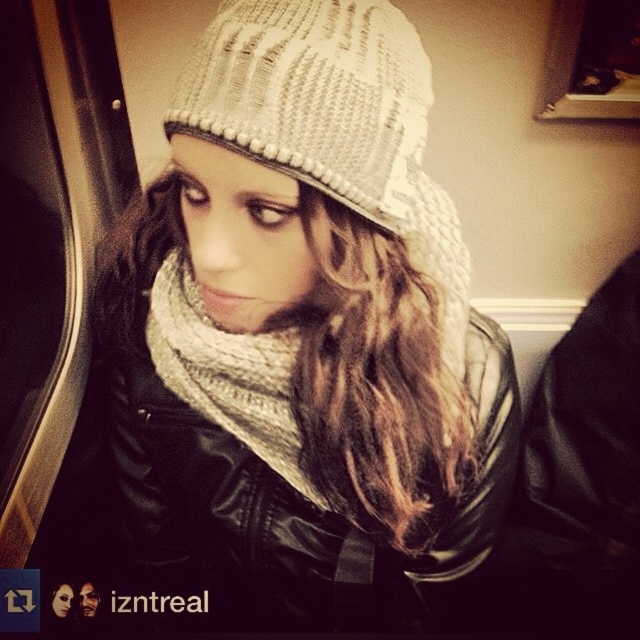
Question: Is white knitted hat at center above knitted beige scarf at center?

Choices:
 (A) yes
 (B) no

Answer: (A)

Question: Considering the real-world distances, which object is closest to the knitted beige hat at center?

Choices:
 (A) knitted beige scarf at center
 (B) white knitted hat at center

Answer: (B)

Question: Can you confirm if white knitted hat at center is positioned to the left of knitted beige hat at center?

Choices:
 (A) yes
 (B) no

Answer: (A)

Question: Among these objects, which one is farthest from the camera?

Choices:
 (A) knitted beige scarf at center
 (B) knitted beige hat at center
 (C) white knitted hat at center

Answer: (A)

Question: Can you confirm if white knitted hat at center is smaller than knitted beige scarf at center?

Choices:
 (A) no
 (B) yes

Answer: (A)

Question: Which object is positioned farthest from the white knitted hat at center?

Choices:
 (A) knitted beige scarf at center
 (B) knitted beige hat at center

Answer: (A)